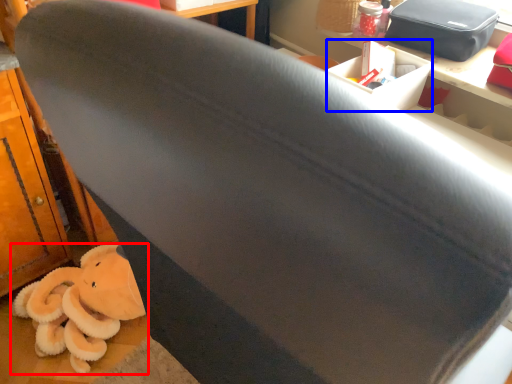
Question: Which object is closer to the camera taking this photo, toy (highlighted by a red box) or box (highlighted by a blue box)?

Choices:
 (A) toy
 (B) box

Answer: (B)